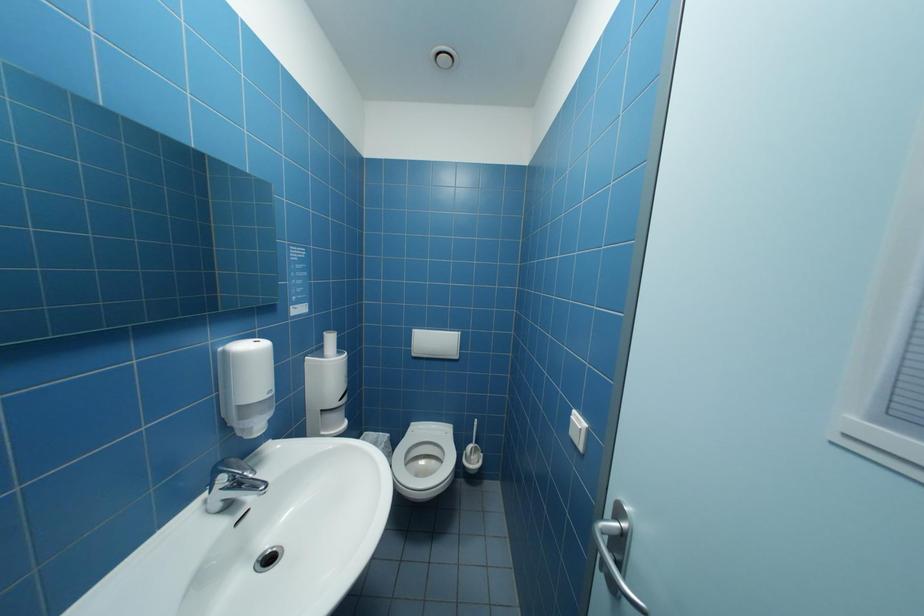
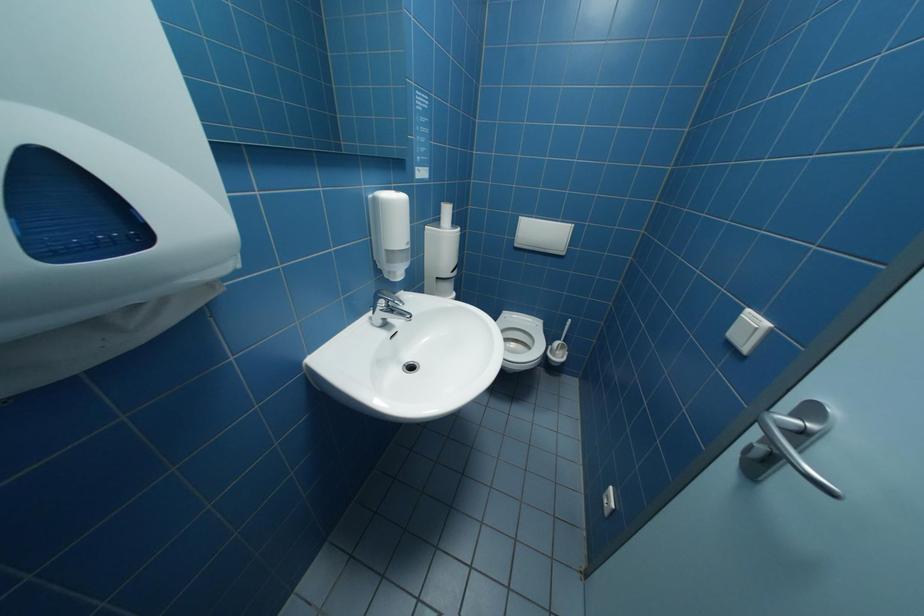
Based on the continuous images, in which direction is the camera rotating?

The camera's rotation is toward left-down.